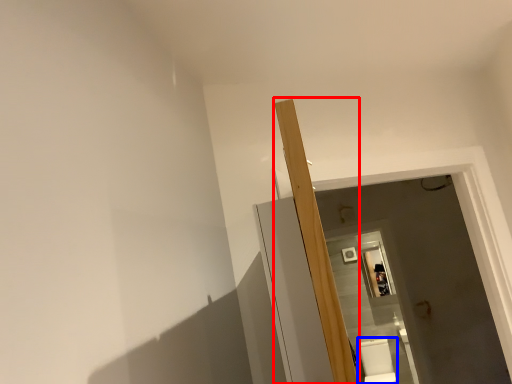
Question: Which object appears farthest to the camera in this image, beam (highlighted by a red box) or toilet bowl (highlighted by a blue box)?

Choices:
 (A) beam
 (B) toilet bowl

Answer: (B)